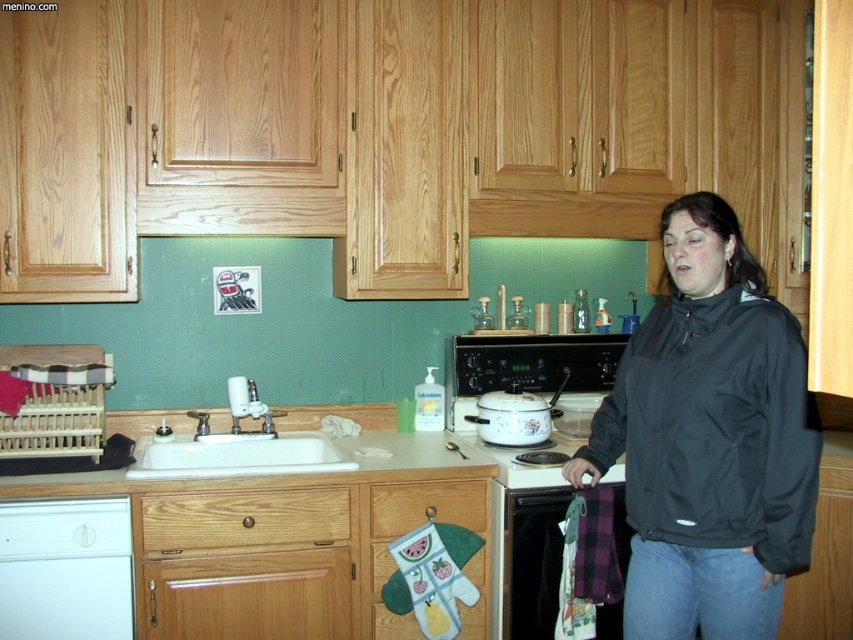
You are organizing the kitchen and want to place a new spice rack between the white glossy dishwasher at lower left and the metallic silver oven at lower center. Given their sizes, will there be enough space for the spice rack?

The white glossy dishwasher at lower left occupies less space than the metallic silver oven at lower center. However, without knowing the exact dimensions of the spice rack, it is impossible to determine if there will be enough space between them. Please provide the size of the spice rack for a more accurate assessment.

You are standing in the kitchen and want to load dishes into the dishwasher. Which appliance should you approach first, the white glossy dishwasher at lower left or the metallic silver oven at lower center?

The white glossy dishwasher at lower left is closer to the viewer than the metallic silver oven at lower center, so you should approach the white glossy dishwasher at lower left first.